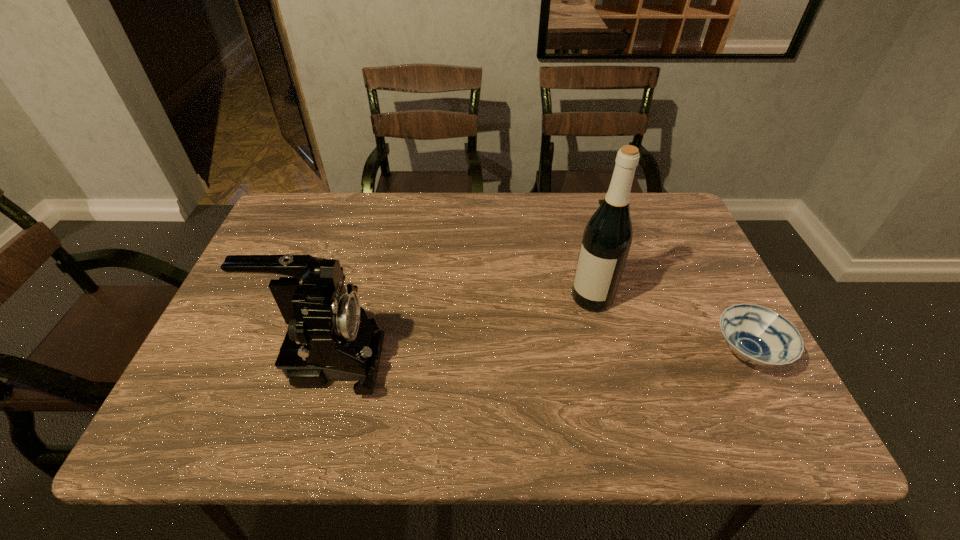
Where is `free spot on the desktop that is between the camcorder and the rightmost object and is positioned in front of the lenses of the sunglasses`? This screenshot has height=540, width=960. free spot on the desktop that is between the camcorder and the rightmost object and is positioned in front of the lenses of the sunglasses is located at coordinates (588, 355).

Find the location of a particular element. Image resolution: width=960 pixels, height=540 pixels. free space on the desktop that is between the third shortest object and the soup bowl and is positioned on the label of the tallest object is located at coordinates (544, 355).